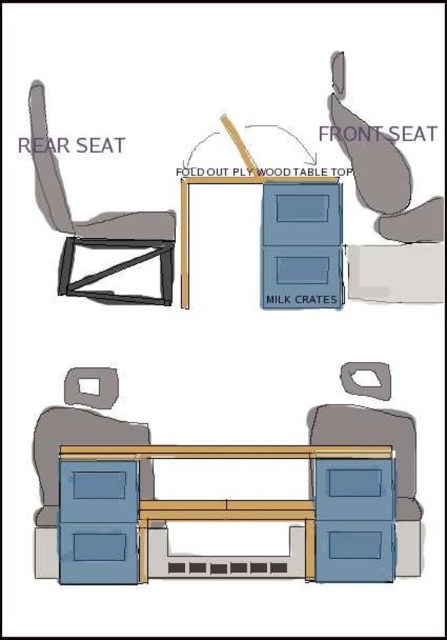
Question: Estimate the real-world distances between objects in this image. Which object is closer to the matte gray chair at rear?

Choices:
 (A) wooden table top at center
 (B) matte gray swivel chair at lower center
 (C) blue matte cabinet at center

Answer: (A)

Question: Can you confirm if blue matte cabinet at center is wider than matte gray chair at rear?

Choices:
 (A) no
 (B) yes

Answer: (B)

Question: Which of the following is the farthest from the observer?

Choices:
 (A) blue matte cabinet at center
 (B) wooden table top at center
 (C) matte gray swivel chair at lower center
 (D) matte gray chair at rear

Answer: (B)

Question: Which of the following is the farthest from the observer?

Choices:
 (A) blue matte cabinet at center
 (B) matte gray chair at rear
 (C) wooden table top at center
 (D) matte gray swivel chair at lower center

Answer: (C)

Question: Can you confirm if blue matte cabinet at center is wider than wooden table top at center?

Choices:
 (A) no
 (B) yes

Answer: (B)

Question: Does blue matte cabinet at center have a greater width compared to wooden table top at center?

Choices:
 (A) yes
 (B) no

Answer: (A)